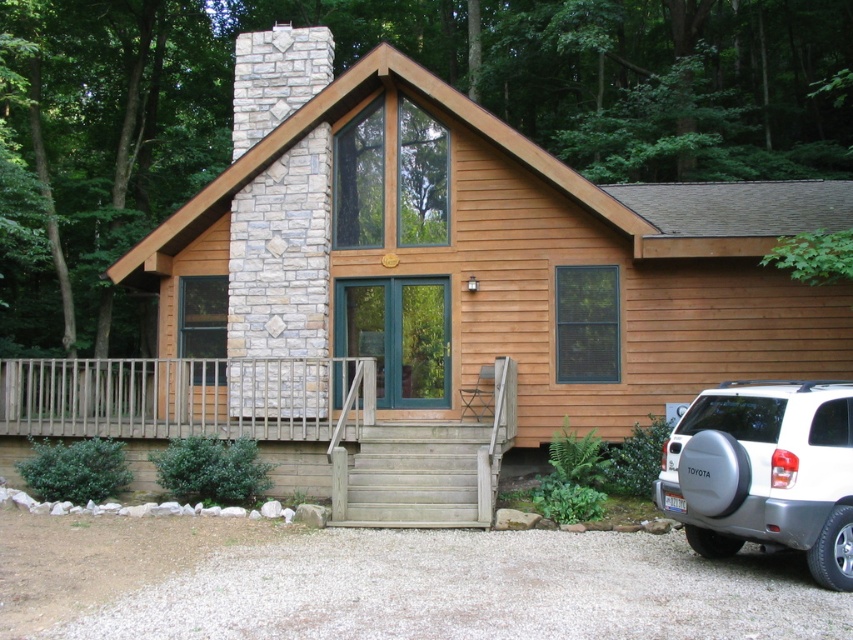
Question: Considering the real-world distances, which object is farthest from the silver metallic suv at lower right?

Choices:
 (A) wooden porch at center
 (B) wooden cabin at center
 (C) wooden stairs at center

Answer: (A)

Question: Is wooden cabin at center above wooden stairs at center?

Choices:
 (A) no
 (B) yes

Answer: (B)

Question: Which point appears closest to the camera in this image?

Choices:
 (A) (793, 412)
 (B) (297, 442)

Answer: (A)

Question: In this image, where is wooden porch at center located relative to silver metallic suv at lower right?

Choices:
 (A) below
 (B) above

Answer: (B)

Question: Does wooden porch at center have a larger size compared to wooden stairs at center?

Choices:
 (A) yes
 (B) no

Answer: (B)

Question: Considering the real-world distances, which object is farthest from the wooden stairs at center?

Choices:
 (A) wooden porch at center
 (B) silver metallic suv at lower right

Answer: (A)